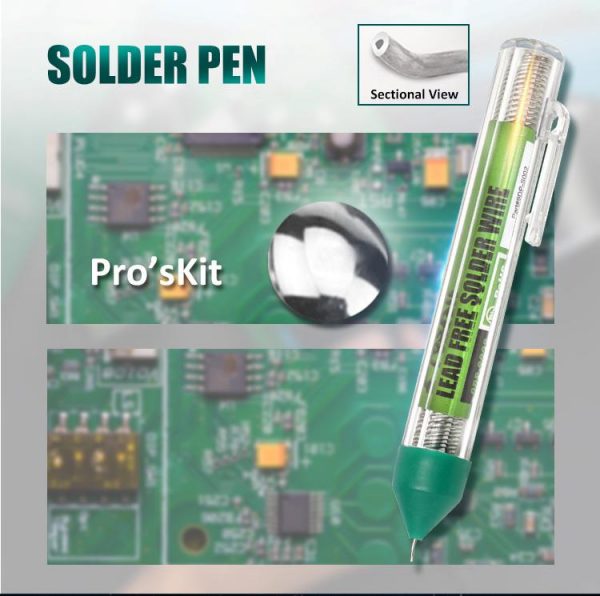
Identify the location of computer. This screenshot has width=600, height=596. (107, 445).